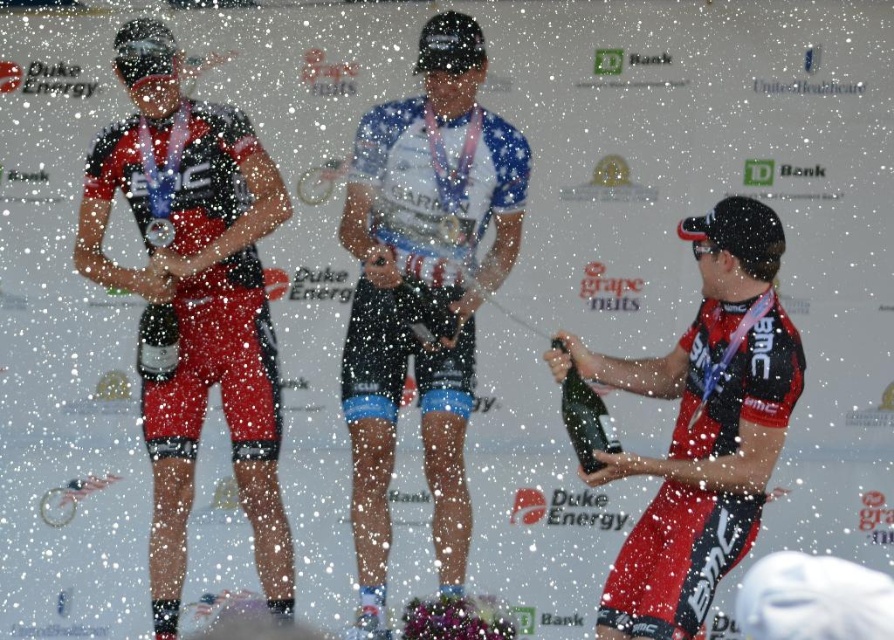
Question: Is white matte jersey at center wider than metallic silver medal at center?

Choices:
 (A) yes
 (B) no

Answer: (A)

Question: Considering the relative positions of shiny silver bottle at right and metallic silver medal at center in the image provided, where is shiny silver bottle at right located with respect to metallic silver medal at center?

Choices:
 (A) right
 (B) left

Answer: (A)

Question: Does white matte jersey at center appear on the right side of matte black jersey at right?

Choices:
 (A) no
 (B) yes

Answer: (A)

Question: Which object appears farthest from the camera in this image?

Choices:
 (A) matte black suit at left
 (B) white matte jersey at center
 (C) shiny silver bottle at right

Answer: (A)

Question: Which object is positioned farthest from the metallic silver medal at center?

Choices:
 (A) shiny silver bottle at right
 (B) white matte jersey at center

Answer: (A)

Question: Which point appears farthest from the camera in this image?

Choices:
 (A) (173, 160)
 (B) (452, 54)

Answer: (A)